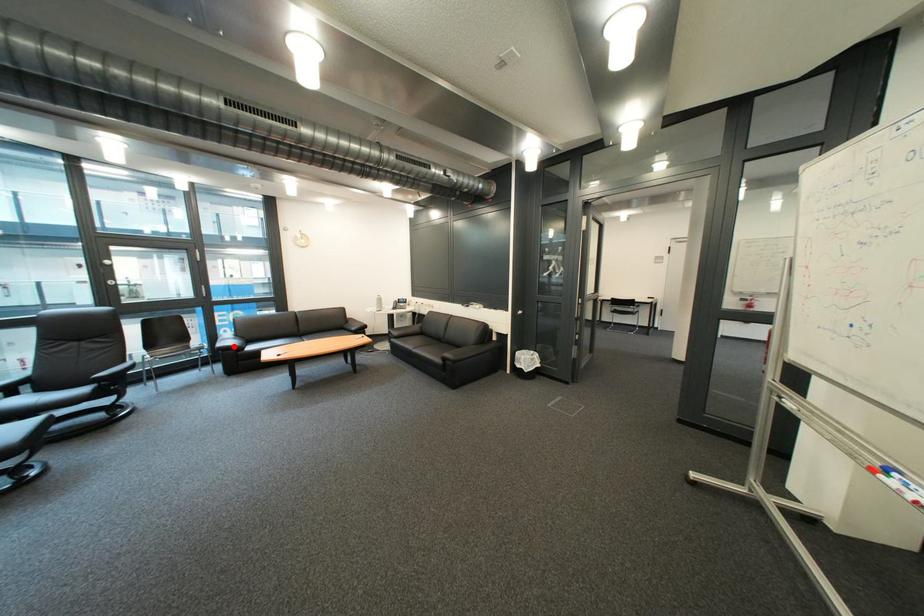
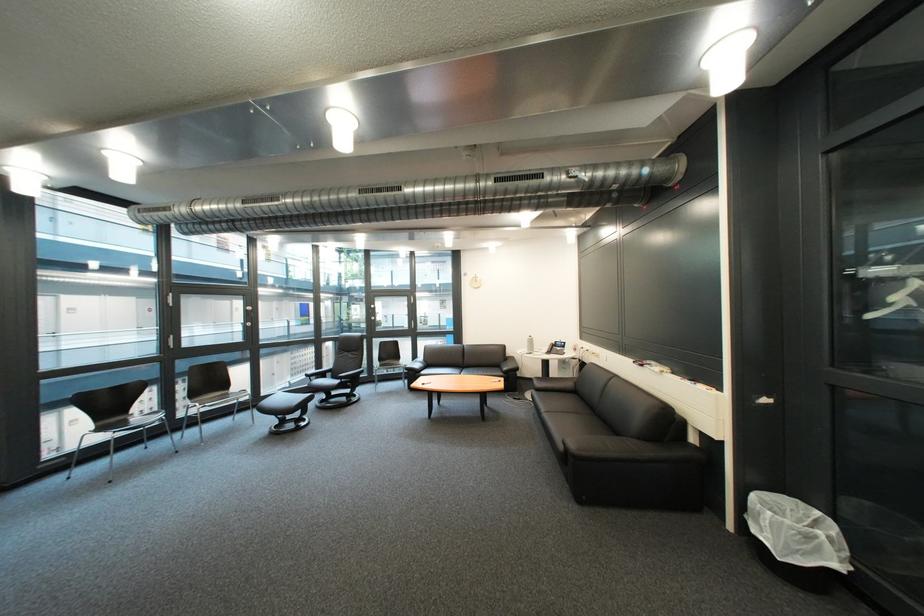
Question: I am providing you with two images of the same scene from different viewpoints. A red point is shown in image1. For the corresponding object point in image2, is it positioned nearer or farther from the camera?

Choices:
 (A) Nearer
 (B) Farther

Answer: (B)